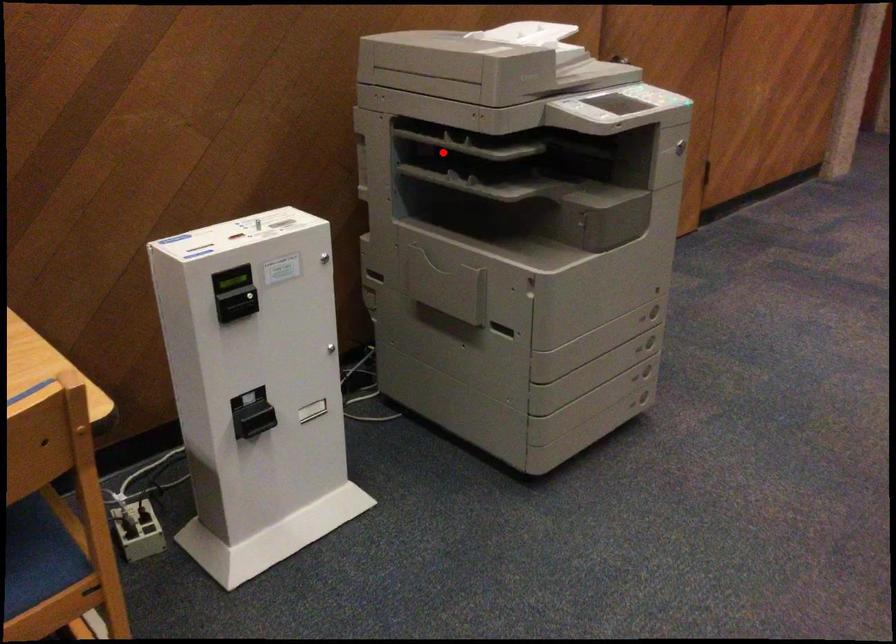
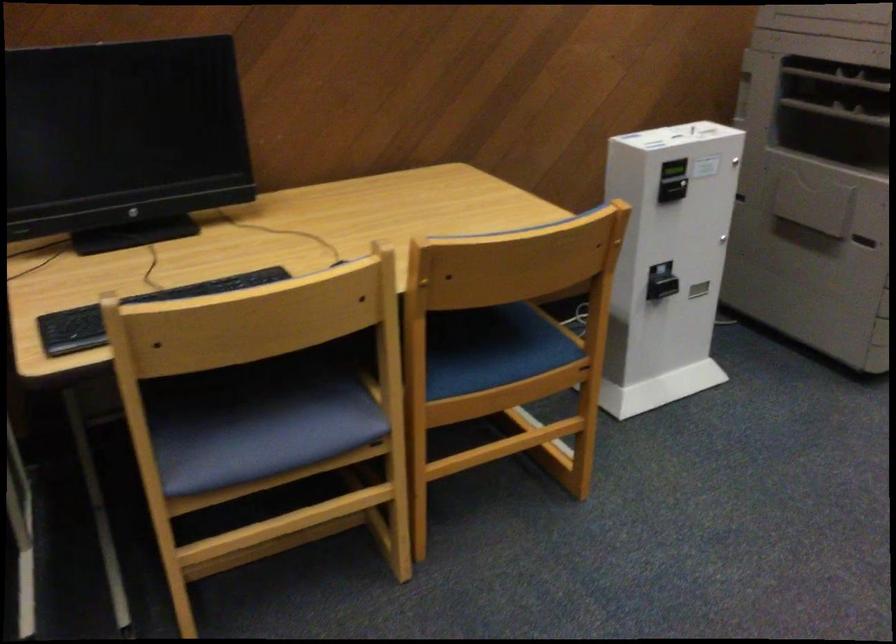
Question: A red point is marked in image1. In image2, is the corresponding 3D point closer to the camera or farther? Reply with the corresponding letter.

Choices:
 (A) The corresponding 3D point is closer.
 (B) The corresponding 3D point is farther.

Answer: (B)